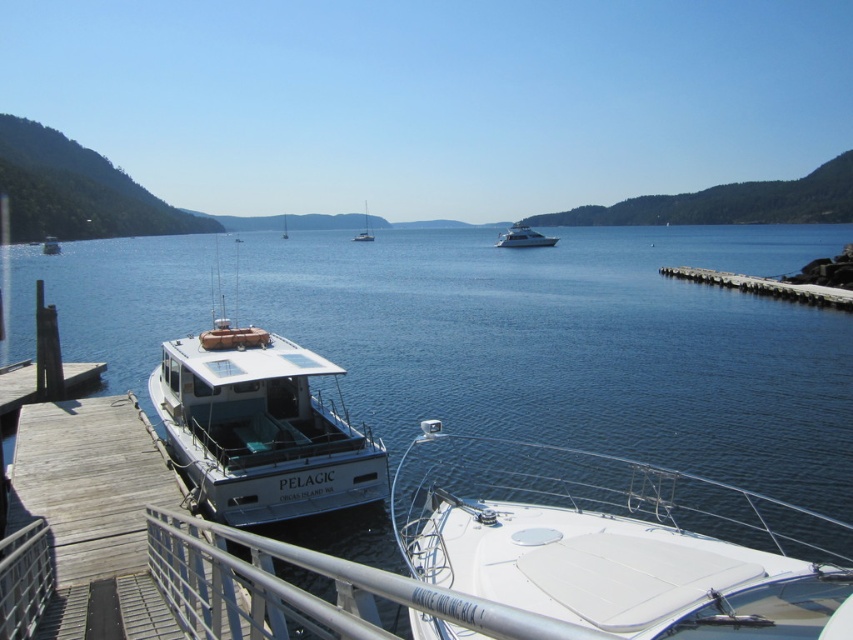
You are standing on the wooden dock in the scene and want to locate the white matte boat at lower left. According to the coordinates provided, where would you find it?

The white matte boat at lower left is located at coordinates point [259,428].

You are a marine biologist planning to board one of the boats for a research trip. You need a vessel that can accommodate your team of 6 people. Based on the scene, which boat between the white glossy yacht at center and the white matte boat at left is more likely to have enough space?

The white matte boat at left is wider than the white glossy yacht at center, so it is more likely to have enough space for a team of 6 people.